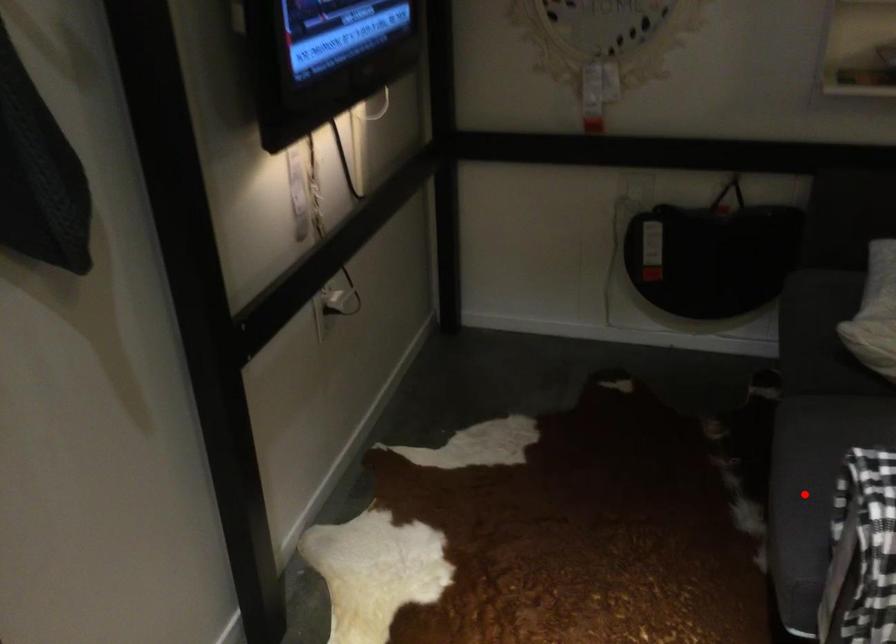
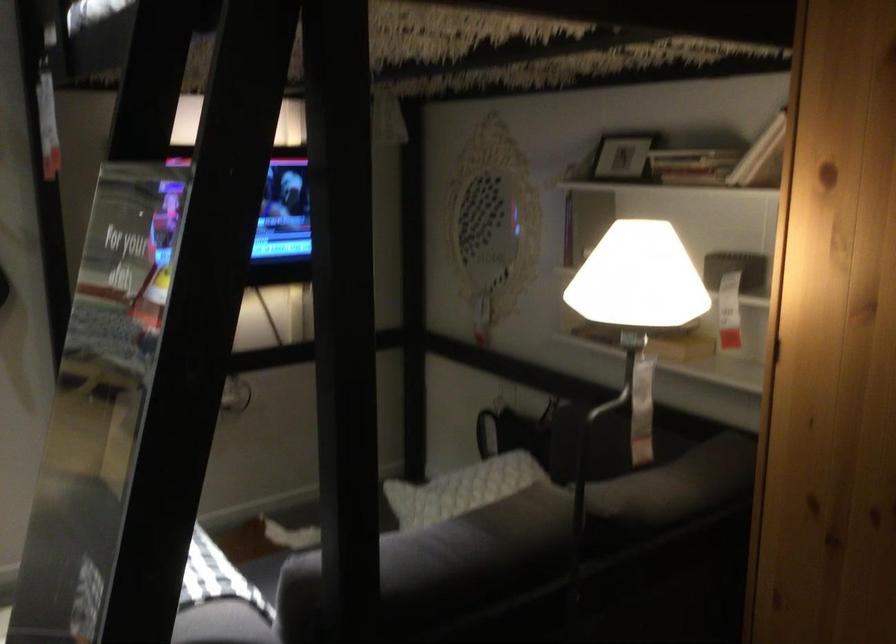
Question: I am providing you with two images of the same scene from different viewpoints. A red point is marked on the first image. Is the red point's position out of view in image 2?

Choices:
 (A) Yes
 (B) No

Answer: (A)